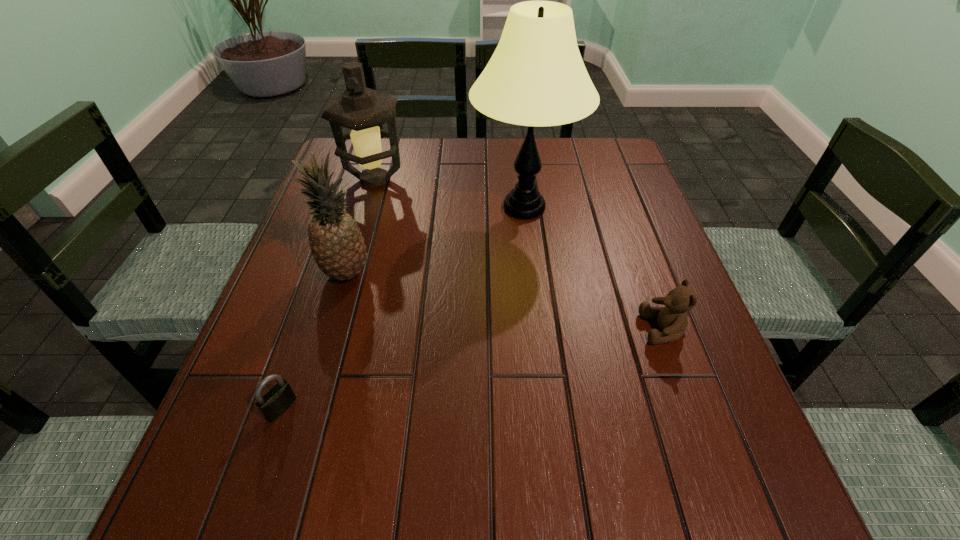
At what (x,y) coordinates should I click in order to perform the action: click on unoccupied position between the pineapple and the fourth tallest object. Please return your answer as a coordinate pair (x, y). The height and width of the screenshot is (540, 960). Looking at the image, I should click on (505, 301).

Locate an element on the screen. The height and width of the screenshot is (540, 960). empty location between the pineapple and the oil lamp is located at coordinates (360, 226).

At what (x,y) coordinates should I click in order to perform the action: click on vacant space that is in between the pineapple and the second object from right to left. Please return your answer as a coordinate pair (x, y). Image resolution: width=960 pixels, height=540 pixels. Looking at the image, I should click on (435, 240).

Find the location of a particular element. free space between the second shortest object and the shortest object is located at coordinates (472, 368).

Identify the location of vacant space that's between the oil lamp and the tallest object. (449, 194).

At what (x,y) coordinates should I click in order to perform the action: click on free spot between the second object from right to left and the teddy bear. Please return your answer as a coordinate pair (x, y). The width and height of the screenshot is (960, 540). Looking at the image, I should click on (593, 268).

Image resolution: width=960 pixels, height=540 pixels. I want to click on vacant space that is in between the oil lamp and the fourth object from left to right, so click(x=449, y=194).

Locate an element on the screen. the fourth closest object relative to the lamp is located at coordinates (279, 398).

The width and height of the screenshot is (960, 540). I want to click on the fourth closest object to the third farthest object, so click(672, 319).

Identify the location of vacant space that satisfies the following two spatial constraints: 1. on the front-facing side of the rightmost object; 2. on the front side of the shortest object. (x=691, y=408).